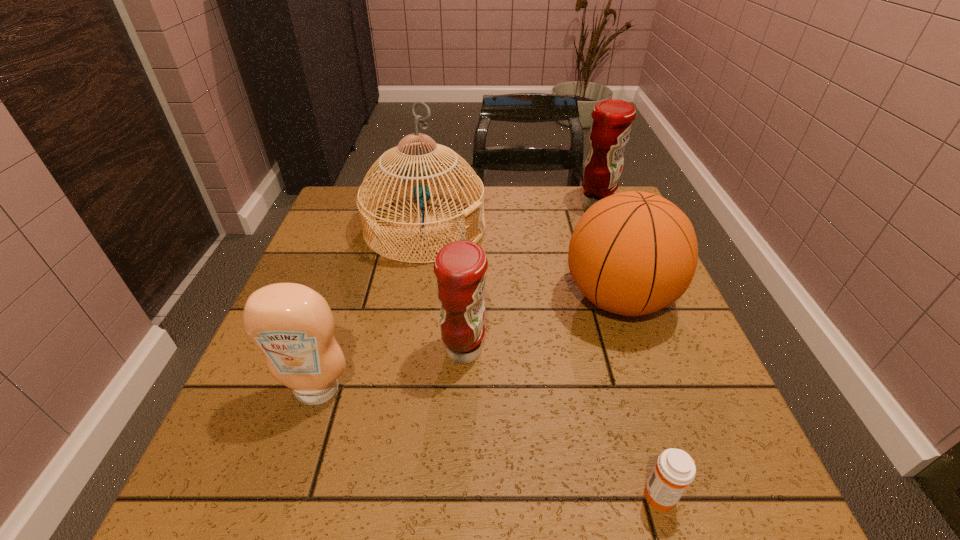
Identify the location of free spot located on the front of the basketball. The width and height of the screenshot is (960, 540). (649, 388).

Identify the location of free region located 0.090m on the label of the leftmost condiment. (295, 459).

Identify the location of vacant area situated 0.060m on the back of the second condiment from right to left. The height and width of the screenshot is (540, 960). (466, 308).

At what (x,y) coordinates should I click in order to perform the action: click on free space located on the left of the medicine. Please return your answer as a coordinate pair (x, y). The width and height of the screenshot is (960, 540). Looking at the image, I should click on (563, 495).

Where is `birdcage that is positioned at the far edge`? The image size is (960, 540). birdcage that is positioned at the far edge is located at coordinates (414, 170).

The image size is (960, 540). I want to click on condiment at the far edge, so click(612, 119).

Identify the location of object located in the near edge section of the desktop. (675, 469).

At what (x,y) coordinates should I click in order to perform the action: click on birdcage located in the left edge section of the desktop. Please return your answer as a coordinate pair (x, y). Looking at the image, I should click on (414, 170).

This screenshot has height=540, width=960. I want to click on condiment positioned at the left edge, so click(x=293, y=326).

Find the location of `condiment that is at the right edge`. condiment that is at the right edge is located at coordinates (612, 119).